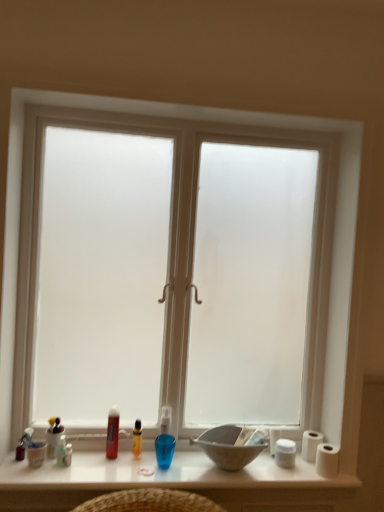
The image size is (384, 512). Find the location of `vacant region to the left of white matte toilet paper at right, the first toilet paper positioned from the front`. vacant region to the left of white matte toilet paper at right, the first toilet paper positioned from the front is located at coordinates (289, 472).